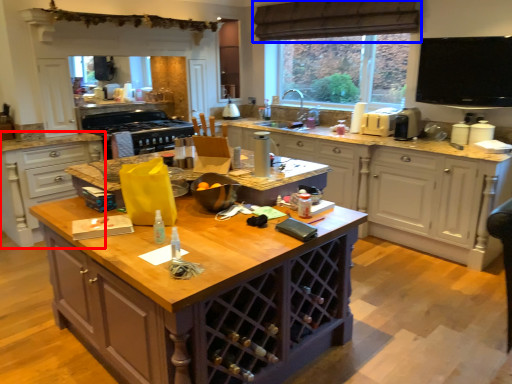
Question: Among these objects, which one is nearest to the camera, cabinetry (highlighted by a red box) or curtain (highlighted by a blue box)?

Choices:
 (A) cabinetry
 (B) curtain

Answer: (A)